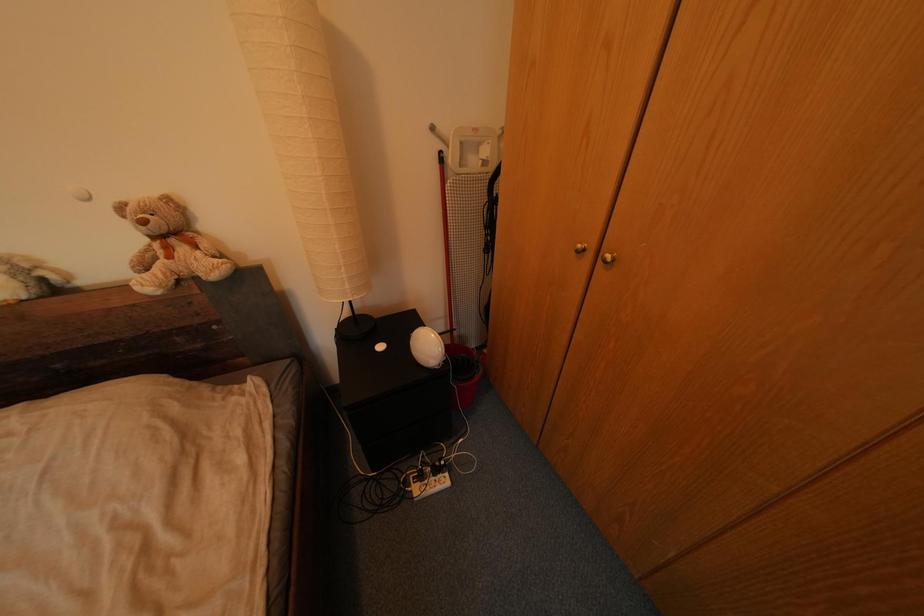
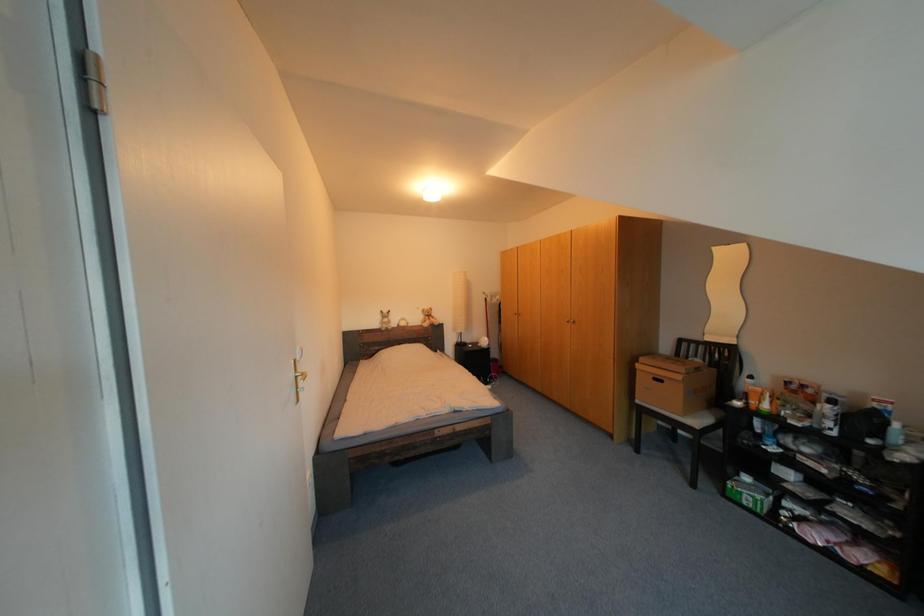
Question: Which direction would the cameraman need to move to produce the second image? Reply with the corresponding letter.

Choices:
 (A) Left
 (B) Right
 (C) Forward
 (D) Backward

Answer: (D)